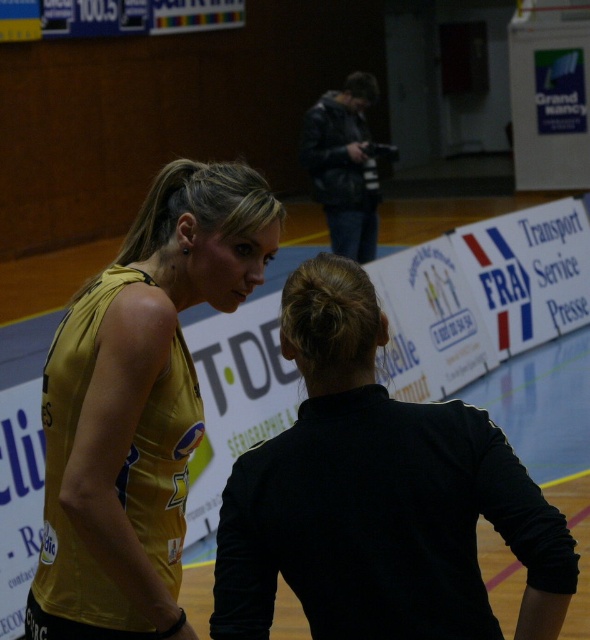
You are a photographer trying to capture a closeup of both the gold jersey at left and the dark gray leather jacket at upper center. Given their sizes, which one might require you to step back further to include the entire object in the frame?

The gold jersey at left is bigger than the dark gray leather jacket at upper center, so you would need to step back further to include the entire gold jersey at left in the frame.

You are a photographer standing at the back of the sports hall. You want to take a photo that includes both the gold jersey at left and the dark gray leather jacket at upper center. Given that your camera has a maximum zoom range of 10 meters, can you capture both subjects in the same frame without moving closer?

The gold jersey at left and the dark gray leather jacket at upper center are 8.66 meters apart. Since the camera can zoom up to 10 meters, which is greater than the distance between them, you can capture both subjects in the same frame without moving closer.

You are a photographer positioned at the entrance of the sports hall. You need to capture a photo that includes both the gold jersey at left and the dark gray leather jacket at upper center. Based on their positions, which object should you adjust your camera focus to first to ensure both are in the frame?

The gold jersey at left is to the left of dark gray leather jacket at upper center, so you should first focus on the gold jersey at left to ensure it is included in the frame before adjusting to include the dark gray leather jacket at upper center.